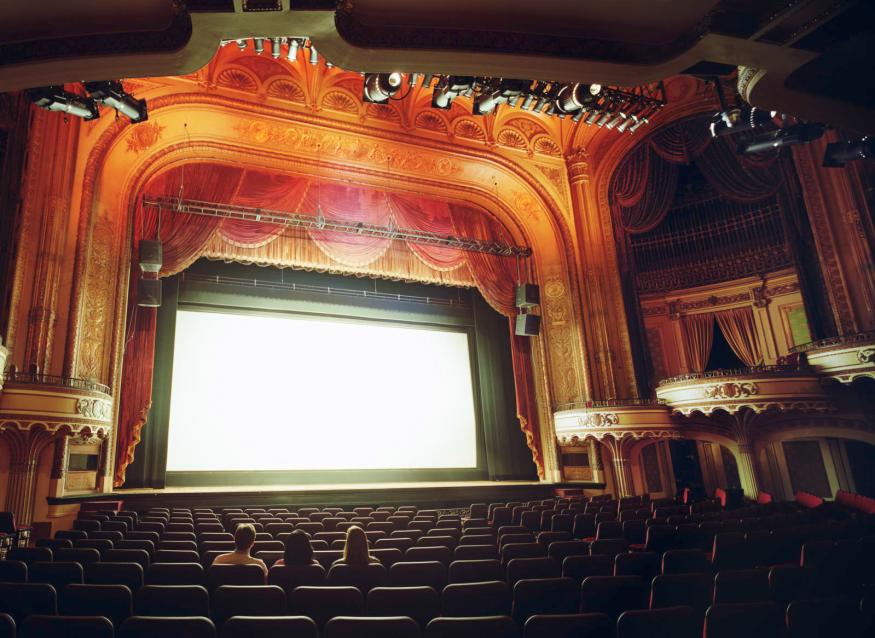
Identify the location of screen. This screenshot has width=875, height=638. (360, 392).